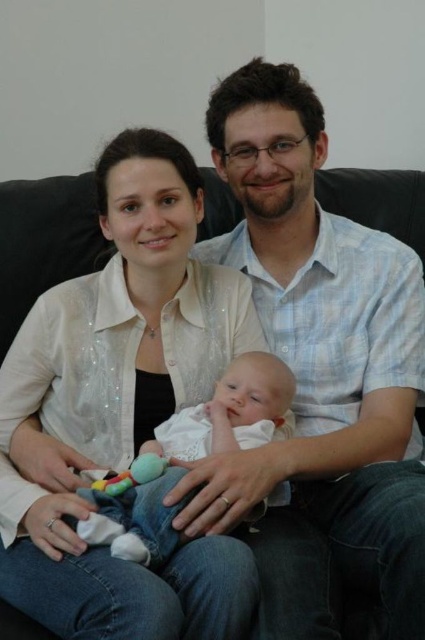
Question: Which point is farther to the camera?

Choices:
 (A) (139, 500)
 (B) (141, 483)
 (C) (190, 337)
 (D) (362, 472)

Answer: (C)

Question: Does white glittery blouse at center have a larger size compared to white soft fabric baby at center?

Choices:
 (A) yes
 (B) no

Answer: (A)

Question: Is white glittery blouse at center bigger than plush multicolored toy at center?

Choices:
 (A) yes
 (B) no

Answer: (A)

Question: Which of these objects is positioned closest to the white glittery blouse at center?

Choices:
 (A) blue plaid shirt at center
 (B) white soft fabric baby at center
 (C) plush multicolored toy at center

Answer: (B)

Question: Is white glittery blouse at center closer to camera compared to plush multicolored toy at center?

Choices:
 (A) yes
 (B) no

Answer: (A)

Question: Which of the following is the farthest from the observer?

Choices:
 (A) white soft fabric baby at center
 (B) white glittery blouse at center

Answer: (A)